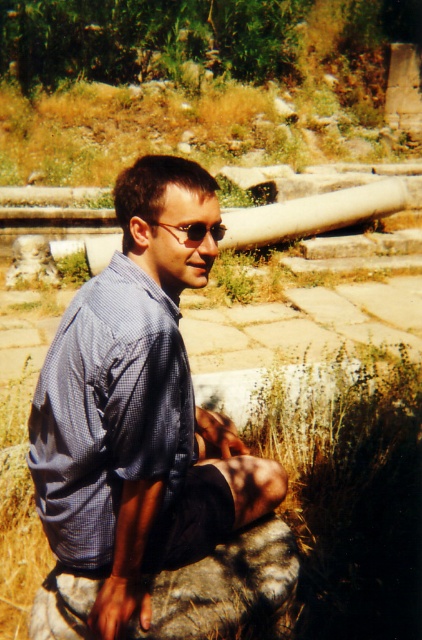
You are a photographer trying to capture a closeup of the blue checkered dress shirt at center and the matte black sunglasses at center. Your camera has a minimum focus distance of 50 centimeters. Can you focus on both objects without moving the camera?

The blue checkered dress shirt at center is 53.84 centimeters away from matte black sunglasses at center. Since the minimum focus distance is 50 centimeters, the camera can focus on both objects as the distance between them is within the required range.

You are a photographer trying to capture a closeup of the blue checkered dress shirt at center and the matte black sunglasses at center. Which object should you zoom in more on to ensure both are in focus?

The blue checkered dress shirt at center is wider than the matte black sunglasses at center, so you should zoom in more on the blue checkered dress shirt at center to ensure both are in focus.